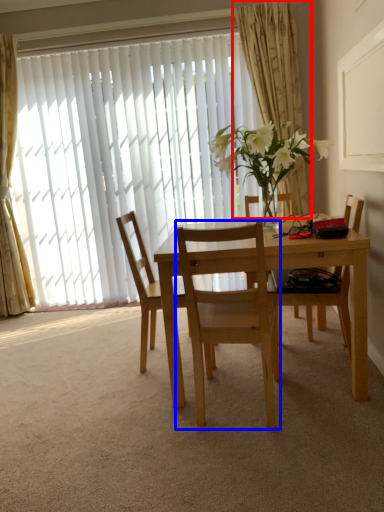
Question: Among these objects, which one is farthest to the camera, curtain (highlighted by a red box) or chair (highlighted by a blue box)?

Choices:
 (A) curtain
 (B) chair

Answer: (A)